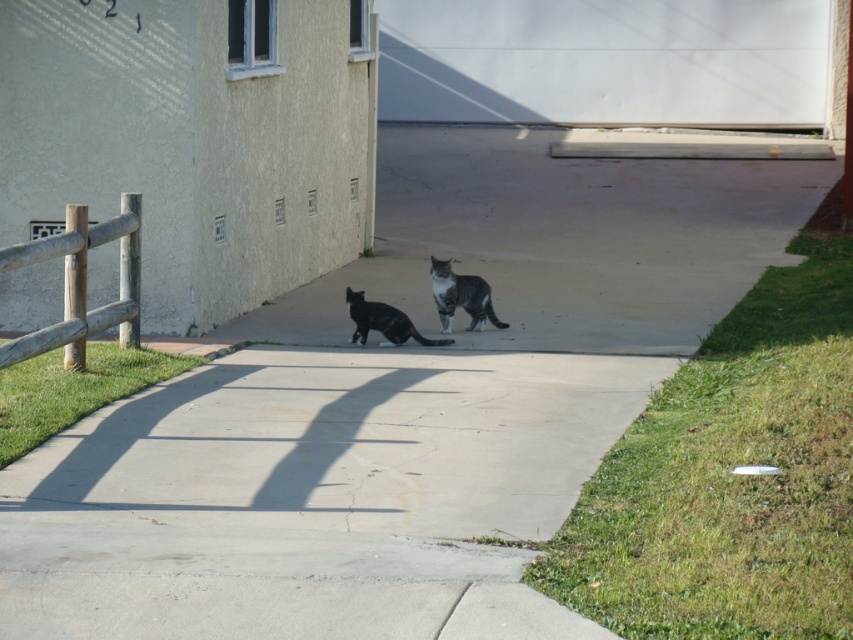
Question: Can you confirm if striped fur cat at center is thinner than shiny black cat at center?

Choices:
 (A) yes
 (B) no

Answer: (A)

Question: Does striped fur cat at center appear on the right side of shiny black cat at center?

Choices:
 (A) no
 (B) yes

Answer: (B)

Question: Which point is farther from the camera taking this photo?

Choices:
 (A) (454, 284)
 (B) (390, 321)

Answer: (A)

Question: Which point is closer to the camera?

Choices:
 (A) (369, 316)
 (B) (438, 305)

Answer: (A)

Question: Which object is closer to the camera taking this photo?

Choices:
 (A) striped fur cat at center
 (B) shiny black cat at center

Answer: (B)

Question: Does striped fur cat at center have a smaller size compared to shiny black cat at center?

Choices:
 (A) yes
 (B) no

Answer: (B)